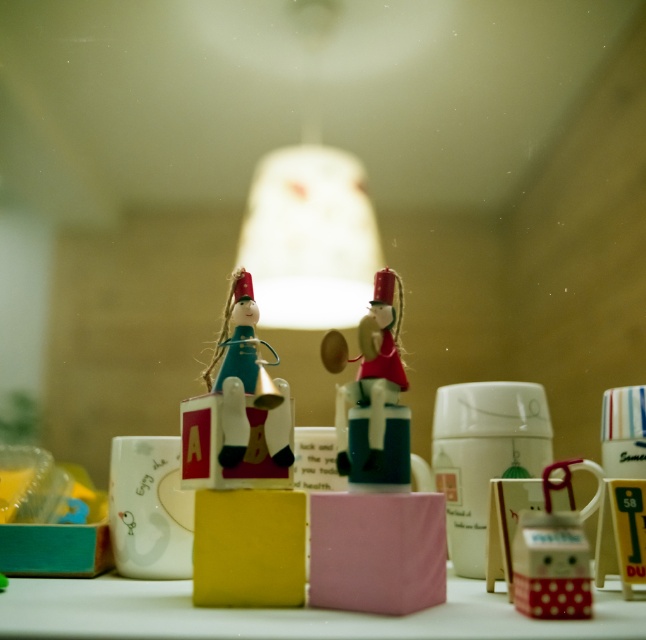
Is point (280, 493) positioned behind point (382, 276)?

No, it is not.

Does point (262, 444) lie in front of point (375, 435)?

No, it is behind (375, 435).

You are a GUI agent. You are given a task and a screenshot of the screen. Output one action in this format:
    pyautogui.click(x=<x>, y=<y>)
    Task: Click on the wooden figure at center
    
    Given the screenshot: What is the action you would take?
    pyautogui.click(x=242, y=474)

Where is `white matte table at center`? Image resolution: width=646 pixels, height=640 pixels. white matte table at center is located at coordinates (x=287, y=612).

Identify the location of white matte table at center. This screenshot has height=640, width=646. (287, 612).

Locate an element on the screen. This screenshot has width=646, height=640. white matte table at center is located at coordinates (287, 612).

Which of these two, wooden figure at center or white matte table at center, stands shorter?

With less height is white matte table at center.

Is wooden figure at center bigger than white matte table at center?

Actually, wooden figure at center might be smaller than white matte table at center.

At what (x,y) coordinates should I click in order to perform the action: click on wooden figure at center. Please return your answer as a coordinate pair (x, y). Looking at the image, I should click on pyautogui.click(x=242, y=474).